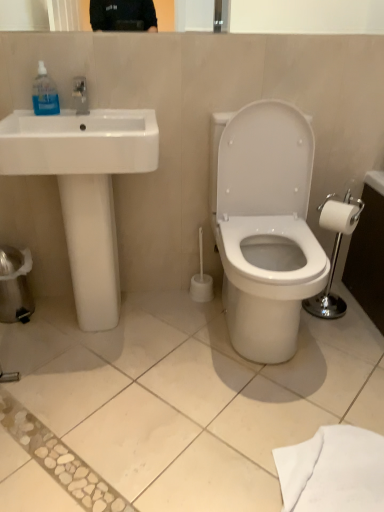
Identify the location of transparent plastic hand sanitizer at upper left. (44, 93).

Describe the element at coordinates (339, 216) in the screenshot. I see `white matte toilet paper at right` at that location.

What do you see at coordinates (264, 225) in the screenshot? The height and width of the screenshot is (512, 384). I see `white glossy toilet at center` at bounding box center [264, 225].

The image size is (384, 512). Identify the location of white glossy sink at left. (85, 188).

Is point (51, 110) positioned after point (89, 320)?

No, it is not.

Between transparent plastic hand sanitizer at upper left and white glossy sink at left, which one has less height?

transparent plastic hand sanitizer at upper left is shorter.

From the image's perspective, is transparent plastic hand sanitizer at upper left positioned above or below white glossy sink at left?

Clearly, from the image's perspective, transparent plastic hand sanitizer at upper left is above white glossy sink at left.

Is transparent plastic hand sanitizer at upper left oriented towards white glossy sink at left?

Yes, transparent plastic hand sanitizer at upper left is facing white glossy sink at left.

From the picture: Which object is thinner, white matte toilet paper at right or transparent plastic hand sanitizer at upper left?

transparent plastic hand sanitizer at upper left.

Could you measure the distance between white matte toilet paper at right and transparent plastic hand sanitizer at upper left?

white matte toilet paper at right and transparent plastic hand sanitizer at upper left are 3.75 feet apart from each other.

From the image's perspective, is white matte toilet paper at right located above transparent plastic hand sanitizer at upper left?

No.

Image resolution: width=384 pixels, height=512 pixels. Find the location of `toilet paper on the right of transparent plastic hand sanitizer at upper left`. toilet paper on the right of transparent plastic hand sanitizer at upper left is located at coordinates (339, 216).

Is transparent plastic hand sanitizer at upper left facing away from white matte toilet paper at right?

No.

Consider the image. Is transparent plastic hand sanitizer at upper left at the right side of white matte toilet paper at right?

No, transparent plastic hand sanitizer at upper left is not to the right of white matte toilet paper at right.

Considering the sizes of objects transparent plastic hand sanitizer at upper left and white matte toilet paper at right in the image provided, who is shorter, transparent plastic hand sanitizer at upper left or white matte toilet paper at right?

white matte toilet paper at right is shorter.

Considering the relative sizes of transparent plastic hand sanitizer at upper left and white matte toilet paper at right in the image provided, is transparent plastic hand sanitizer at upper left smaller than white matte toilet paper at right?

Correct, transparent plastic hand sanitizer at upper left occupies less space than white matte toilet paper at right.

Is white glossy toilet at center to the left or to the right of white glossy sink at left in the image?

Based on their positions, white glossy toilet at center is located to the right of white glossy sink at left.

Between point (282, 312) and point (21, 167), which one is positioned behind?

The point (282, 312) is farther from the camera.

Based on their sizes in the image, would you say white glossy sink at left is bigger or smaller than transparent plastic hand sanitizer at upper left?

Considering their sizes, white glossy sink at left takes up more space than transparent plastic hand sanitizer at upper left.

Is the position of white glossy sink at left less distant than that of transparent plastic hand sanitizer at upper left?

Yes, it is.

Which of these two, white glossy sink at left or transparent plastic hand sanitizer at upper left, stands shorter?

Standing shorter between the two is transparent plastic hand sanitizer at upper left.

Based on the photo, is there a large distance between white glossy sink at left and transparent plastic hand sanitizer at upper left?

No, there isn't a large distance between white glossy sink at left and transparent plastic hand sanitizer at upper left.

From the image's perspective, which one is positioned higher, white glossy sink at left or white matte toilet paper at right?

white glossy sink at left.

Is white glossy sink at left wider or thinner than white matte toilet paper at right?

In the image, white glossy sink at left appears to be wider than white matte toilet paper at right.

Considering the positions of objects white glossy sink at left and white matte toilet paper at right in the image provided, who is more to the left, white glossy sink at left or white matte toilet paper at right?

Positioned to the left is white glossy sink at left.

Can you confirm if white glossy sink at left is shorter than white matte toilet paper at right?

In fact, white glossy sink at left may be taller than white matte toilet paper at right.

Which is more to the right, white matte toilet paper at right or white glossy toilet at center?

From the viewer's perspective, white matte toilet paper at right appears more on the right side.

From the picture: Which is in front, white matte toilet paper at right or white glossy toilet at center?

white glossy toilet at center is in front.

Which is closer to the camera, (340, 209) or (242, 329)?

Point (340, 209) appears to be farther away from the viewer than point (242, 329).

From the image's perspective, is white matte toilet paper at right located above or below white glossy toilet at center?

Clearly, from the image's perspective, white matte toilet paper at right is above white glossy toilet at center.

Locate an element on the screen. This screenshot has width=384, height=512. sink located on the right of transparent plastic hand sanitizer at upper left is located at coordinates (85, 188).

The height and width of the screenshot is (512, 384). I want to click on toilet paper that appears behind the transparent plastic hand sanitizer at upper left, so click(x=339, y=216).

Which object lies further to the anchor point transparent plastic hand sanitizer at upper left, white glossy toilet at center or white glossy sink at left?

white glossy toilet at center lies further to transparent plastic hand sanitizer at upper left than the other object.

Based on the photo, looking at the image, which one is located closer to white glossy sink at left, white glossy toilet at center or transparent plastic hand sanitizer at upper left?

transparent plastic hand sanitizer at upper left.

Based on their spatial positions, is white matte toilet paper at right or white glossy toilet at center further from transparent plastic hand sanitizer at upper left?

white matte toilet paper at right is further to transparent plastic hand sanitizer at upper left.

When comparing their distances from transparent plastic hand sanitizer at upper left, does white glossy sink at left or white matte toilet paper at right seem further?

white matte toilet paper at right lies further to transparent plastic hand sanitizer at upper left than the other object.

Looking at the image, which one is located closer to white glossy sink at left, transparent plastic hand sanitizer at upper left or white glossy toilet at center?

transparent plastic hand sanitizer at upper left is positioned closer to the anchor white glossy sink at left.

When comparing their distances from white glossy sink at left, does white matte toilet paper at right or white glossy toilet at center seem closer?

The object closer to white glossy sink at left is white glossy toilet at center.

Estimate the real-world distances between objects in this image. Which object is closer to white matte toilet paper at right, transparent plastic hand sanitizer at upper left or white glossy sink at left?

white glossy sink at left.

Which object lies nearer to the anchor point white glossy sink at left, transparent plastic hand sanitizer at upper left or white matte toilet paper at right?

transparent plastic hand sanitizer at upper left is closer to white glossy sink at left.

The image size is (384, 512). In order to click on sink located between transparent plastic hand sanitizer at upper left and white matte toilet paper at right in the left-right direction in this screenshot , I will do `click(85, 188)`.

In order to click on toilet located between white glossy sink at left and white matte toilet paper at right in the left-right direction in this screenshot , I will do `click(264, 225)`.

Locate an element on the screen. The image size is (384, 512). toilet between transparent plastic hand sanitizer at upper left and white matte toilet paper at right is located at coordinates (264, 225).

This screenshot has height=512, width=384. Find the location of `sink between transparent plastic hand sanitizer at upper left and white glossy toilet at center in the horizontal direction`. sink between transparent plastic hand sanitizer at upper left and white glossy toilet at center in the horizontal direction is located at coordinates (85, 188).